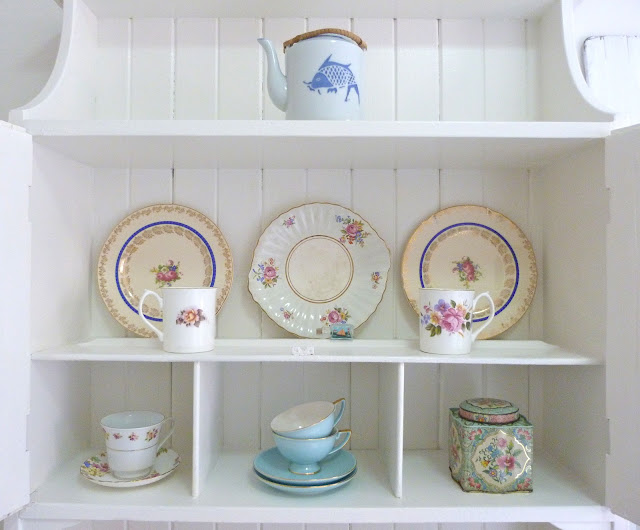
This screenshot has height=530, width=640. Find the location of `urn`. urn is located at coordinates (492, 434).